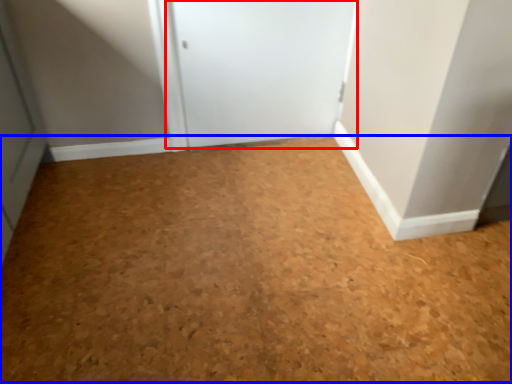
Question: Which object appears farthest to the camera in this image, door (highlighted by a red box) or plain (highlighted by a blue box)?

Choices:
 (A) door
 (B) plain

Answer: (A)